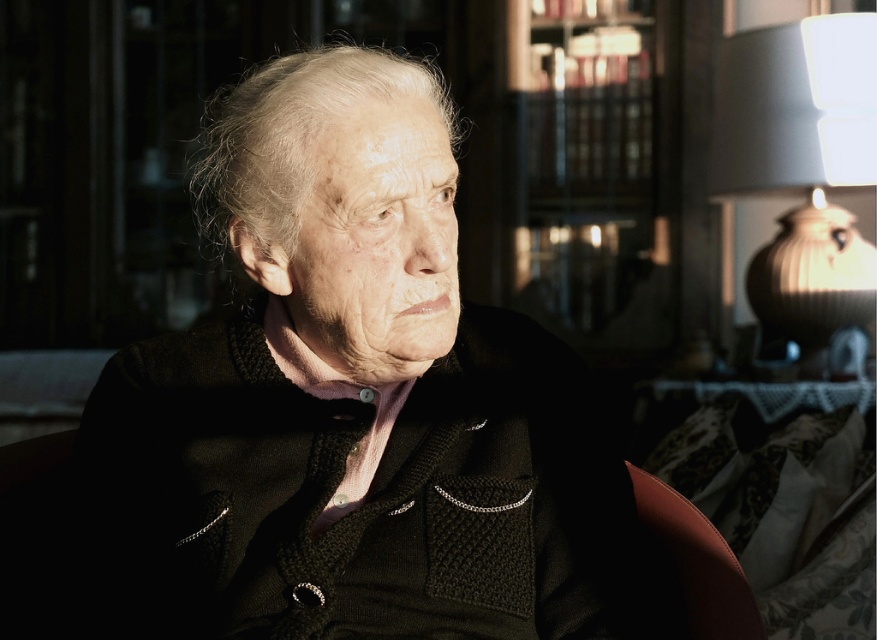
Based on the photo, you are standing in the room and want to place a 1.50 meter long ladder between you and the point at coordinates point (443, 109). Will the ladder reach that point?

The distance between you and the point (443, 109) is 1.40 meters, so the 1.50 meter ladder will be long enough to reach the point.

You are an interior designer planning to place two decorative items at the coordinates point (374, 502) and point (203, 228). Which coordinate is closer to the viewer?

Point (374, 502) is in front of point (203, 228), so it is closer to the viewer.

You are an interior designer planning to place a new painting on the wall. The painting is 2 feet wide. The current lamp is located at point (802, 166). Can you hang the painting to the left of the white ceramic lamp at upper right without overlapping it?

The point (802, 166) marks the white ceramic lamp at upper right. Since the painting is 2 feet wide and you want to place it to the left of the lamp without overlapping, you need to ensure there is sufficient space. However, without knowing the exact dimensions of the wall or the distance between objects, it is impossible to determine if there is enough space. Please provide more information about the wall dimensions or spacing requirements.